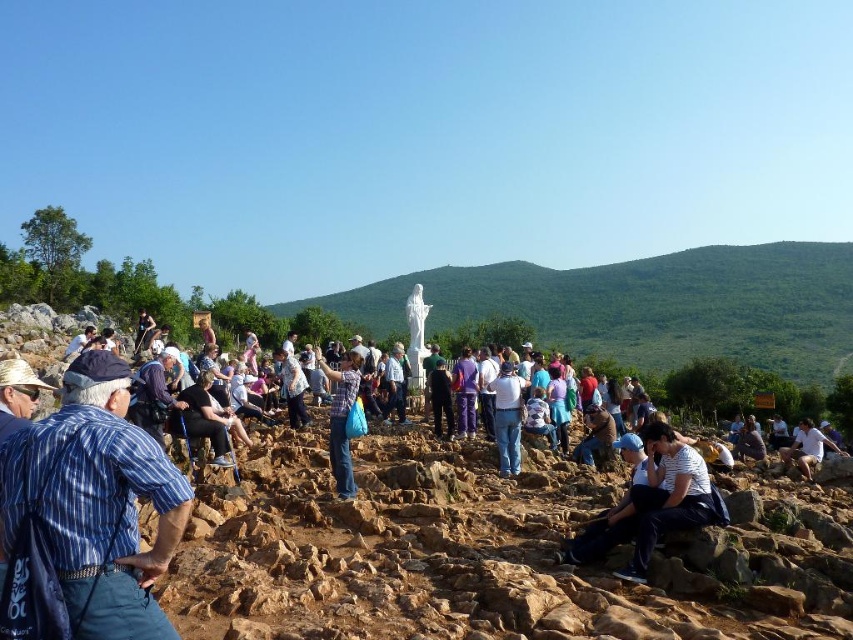
You are a tour guide leading a group to the white marble statue at center. The group is currently standing at the entrance of the site, which is 146.87 meters away from the statue. If your group walks at an average speed of 1.5 meters per second, how many minutes will it take them to reach the statue?

The distance between the entrance and the white marble statue at center is 146.87 meters. At a walking speed of 1.5 meters per second, the time taken would be 146.87 divided by 1.5, which is approximately 97.91 seconds. Converting seconds to minutes, this is roughly 1.63 minutes. Therefore, it will take about 1.6 minutes to reach the white marble statue at center.

You are a photographer trying to capture both the plaid shirt at center and the white fabric shirt at center in a single frame. Which shirt should you focus on first to ensure both are in the frame?

The plaid shirt at center is larger in size compared to the white fabric shirt at center, so you should focus on the plaid shirt at center first to ensure both are in the frame.

Consider the image. You are standing at the point marked by the coordinates point (341, 419) in the image. What is the nearest object to you?

The nearest object to you is the plaid shirt at center, as the point (341, 419) marks its location.